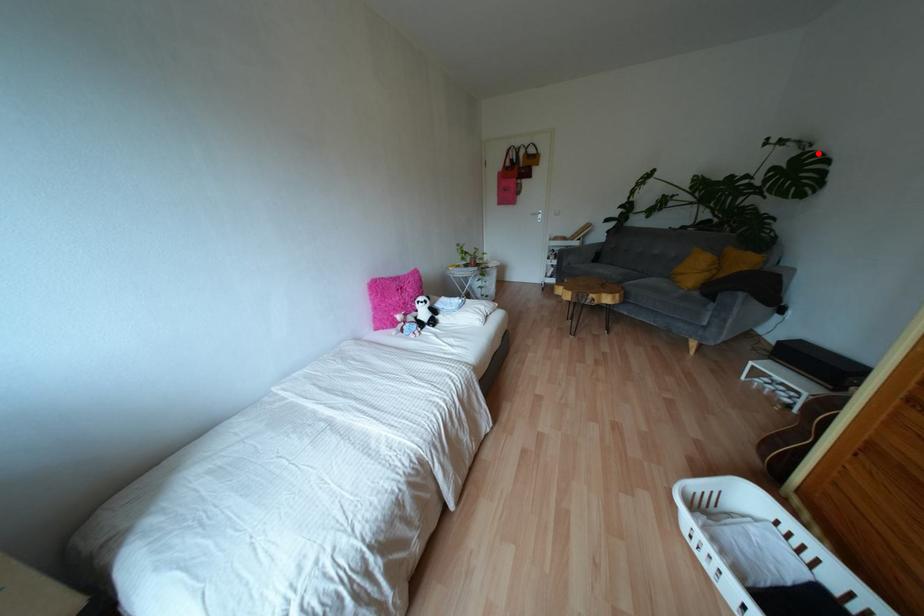
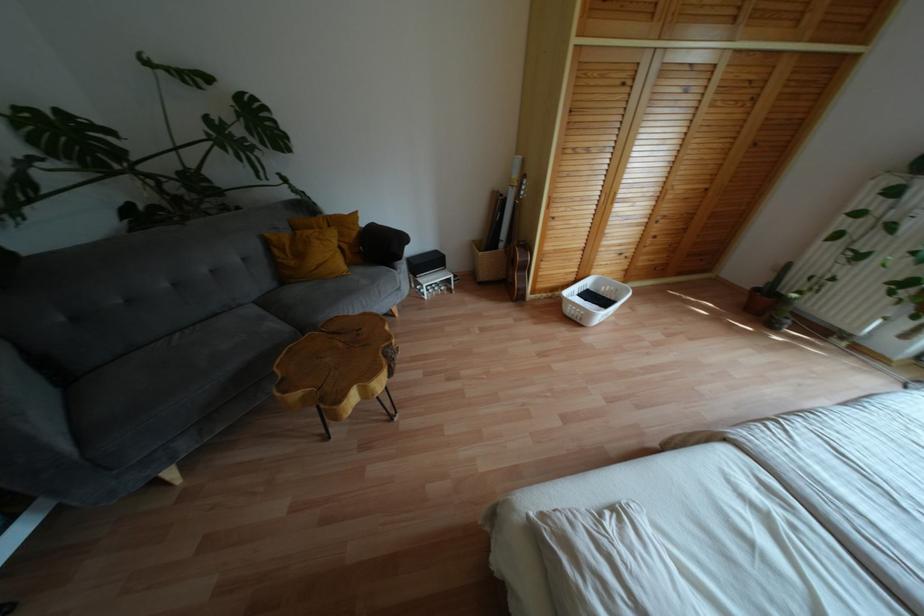
Locate, in the second image, the point that corresponds to the highlighted location in the first image.

(253, 98)